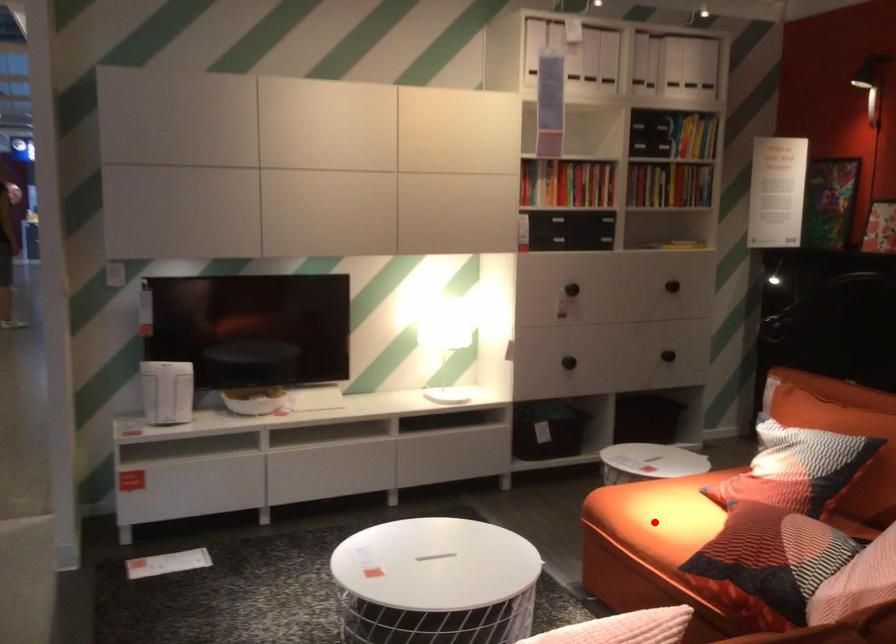
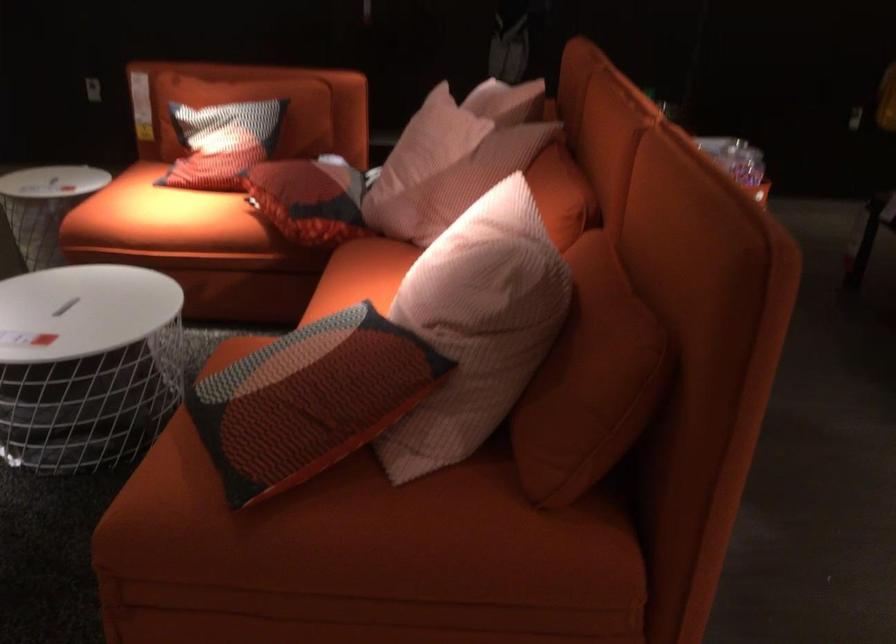
Question: I am providing you with two images of the same scene from different viewpoints. Image1 has a red point marked. In image2, the corresponding 3D location appears at what relative position? Reply with the corresponding letter.

Choices:
 (A) Closer
 (B) Farther

Answer: (B)